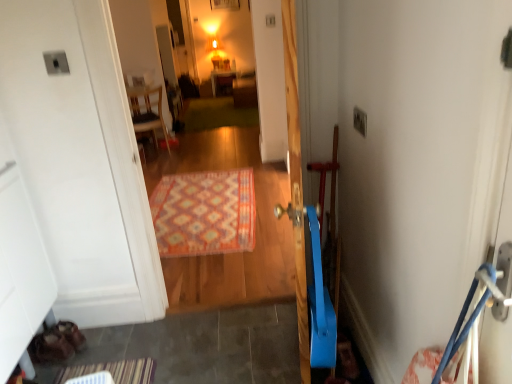
In order to face multicolored woven rug at center, should I rotate leftwards or rightwards?

Rotate left and turn 7.452 degrees.

Describe the element at coordinates (222, 82) in the screenshot. I see `matte wooden cabinet at center, acting as the second furniture starting from the bottom` at that location.

Find the location of a particular element. matte wooden cabinet at center, which is counted as the 1th furniture, starting from the back is located at coordinates (222, 82).

The height and width of the screenshot is (384, 512). Describe the element at coordinates (147, 111) in the screenshot. I see `wooden chair at upper left, the 2th furniture positioned from the top` at that location.

The image size is (512, 384). I want to click on carpeted rug at center, so click(x=256, y=226).

Locate an element on the screen. the 1st furniture behind the carpeted rug at center, starting your count from the anchor is located at coordinates (147, 111).

Is wooden chair at upper left, the second furniture from the right, not within carpeted rug at center?

Indeed, wooden chair at upper left, the second furniture from the right, is completely outside carpeted rug at center.

From the image's perspective, between wooden chair at upper left, which appears as the 1th furniture when ordered from the bottom, and carpeted rug at center, who is located below?

carpeted rug at center.

Which object is further away from the camera taking this photo, wooden chair at upper left, arranged as the 1th furniture when viewed from the front, or carpeted rug at center?

Positioned behind is wooden chair at upper left, arranged as the 1th furniture when viewed from the front.

Is carpeted rug at center oriented away from wooden chair at upper left, arranged as the 1th furniture when viewed from the front?

Absolutely, carpeted rug at center is directed away from wooden chair at upper left, arranged as the 1th furniture when viewed from the front.

Considering the relative positions of carpeted rug at center and wooden chair at upper left, arranged as the 1th furniture when viewed from the front, in the image provided, is carpeted rug at center behind wooden chair at upper left, arranged as the 1th furniture when viewed from the front,?

No, carpeted rug at center is in front of wooden chair at upper left, arranged as the 1th furniture when viewed from the front.

How far apart are carpeted rug at center and wooden chair at upper left, the 2th furniture positioned from the top?

carpeted rug at center is 36.75 inches away from wooden chair at upper left, the 2th furniture positioned from the top.

In the scene shown: From the image's perspective, relative to wooden chair at upper left, arranged as the 1th furniture when viewed from the front, is carpeted rug at center above or below?

carpeted rug at center is below wooden chair at upper left, arranged as the 1th furniture when viewed from the front.

Could you tell me if matte wooden cabinet at center, which is counted as the 1th furniture, starting from the back, is facing multicolored woven rug at center?

Yes, matte wooden cabinet at center, which is counted as the 1th furniture, starting from the back, is turned towards multicolored woven rug at center.

Is matte wooden cabinet at center, which is the 2th furniture from left to right, further to camera compared to multicolored woven rug at center?

Yes, matte wooden cabinet at center, which is the 2th furniture from left to right, is behind multicolored woven rug at center.

From the image's perspective, is matte wooden cabinet at center, placed as the first furniture when sorted from right to left, located above multicolored woven rug at center?

Indeed, from the image's perspective, matte wooden cabinet at center, placed as the first furniture when sorted from right to left, is shown above multicolored woven rug at center.

From a real-world perspective, starting from the multicolored woven rug at center, which furniture is the 2nd one vertically above it? Please provide its 2D coordinates.

[(147, 111)]

From a real-world perspective, is wooden chair at upper left, which ranks as the 2th furniture in back-to-front order, above or below multicolored woven rug at center?

In terms of real-world spatial position, wooden chair at upper left, which ranks as the 2th furniture in back-to-front order, is above multicolored woven rug at center.

How different are the orientations of wooden chair at upper left, which ranks as the 1th furniture in left-to-right order, and multicolored woven rug at center in degrees?

The facing directions of wooden chair at upper left, which ranks as the 1th furniture in left-to-right order, and multicolored woven rug at center are 148 degrees apart.

In terms of width, does wooden chair at upper left, arranged as the 1th furniture when viewed from the front, look wider or thinner when compared to multicolored woven rug at center?

Considering their sizes, wooden chair at upper left, arranged as the 1th furniture when viewed from the front, looks slimmer than multicolored woven rug at center.

From a real-world perspective, which is physically below, carpeted rug at center or multicolored woven rug at center?

multicolored woven rug at center, from a real-world perspective.

Is carpeted rug at center in contact with multicolored woven rug at center?

They are not placed beside each other.

How many degrees apart are the facing directions of carpeted rug at center and multicolored woven rug at center?

The angle between the facing direction of carpeted rug at center and the facing direction of multicolored woven rug at center is 1.27 degrees.

Considering the sizes of objects carpeted rug at center and multicolored woven rug at center in the image provided, who is taller, carpeted rug at center or multicolored woven rug at center?

Standing taller between the two is carpeted rug at center.

Looking at this image, considering the relative sizes of matte wooden cabinet at center, which is counted as the 1th furniture, starting from the back, and carpeted rug at center in the image provided, is matte wooden cabinet at center, which is counted as the 1th furniture, starting from the back, taller than carpeted rug at center?

In fact, matte wooden cabinet at center, which is counted as the 1th furniture, starting from the back, may be shorter than carpeted rug at center.

Considering the sizes of objects matte wooden cabinet at center, which is counted as the 1th furniture, starting from the back, and carpeted rug at center in the image provided, who is thinner, matte wooden cabinet at center, which is counted as the 1th furniture, starting from the back, or carpeted rug at center?

Thinner between the two is carpeted rug at center.

Would you consider matte wooden cabinet at center, which is counted as the 1th furniture, starting from the back, to be distant from carpeted rug at center?

That's right, there is a large distance between matte wooden cabinet at center, which is counted as the 1th furniture, starting from the back, and carpeted rug at center.

In terms of width, does matte wooden cabinet at center, placed as the first furniture when sorted from right to left, look wider or thinner when compared to wooden chair at upper left, which appears as the 1th furniture when ordered from the bottom?

In the image, matte wooden cabinet at center, placed as the first furniture when sorted from right to left, appears to be wider than wooden chair at upper left, which appears as the 1th furniture when ordered from the bottom.

Can you confirm if matte wooden cabinet at center, which is the 2th furniture from front to back, is shorter than wooden chair at upper left, the second furniture from the right?

Yes.

From the image's perspective, is matte wooden cabinet at center, placed as the first furniture when sorted from right to left, beneath wooden chair at upper left, the 2th furniture positioned from the top?

No, from the image's perspective, matte wooden cabinet at center, placed as the first furniture when sorted from right to left, is not beneath wooden chair at upper left, the 2th furniture positioned from the top.

Considering the positions of objects matte wooden cabinet at center, which is the 2th furniture from front to back, and wooden chair at upper left, which ranks as the 2th furniture in back-to-front order, in the image provided, who is more to the right, matte wooden cabinet at center, which is the 2th furniture from front to back, or wooden chair at upper left, which ranks as the 2th furniture in back-to-front order,?

From the viewer's perspective, matte wooden cabinet at center, which is the 2th furniture from front to back, appears more on the right side.

Where is `furniture that is the 1st one when counting upward from the carpeted rug at center (from the image's perspective)`? furniture that is the 1st one when counting upward from the carpeted rug at center (from the image's perspective) is located at coordinates (147, 111).

Which furniture is the 2nd one when counting from the left side of the carpeted rug at center? Please provide its 2D coordinates.

[(147, 111)]

Which object lies nearer to the anchor point multicolored woven rug at center, matte wooden cabinet at center, which is the 2th furniture from front to back, or wooden chair at upper left, arranged as the 1th furniture when viewed from the front?

The object closer to multicolored woven rug at center is wooden chair at upper left, arranged as the 1th furniture when viewed from the front.

Estimate the real-world distances between objects in this image. Which object is further from wooden chair at upper left, arranged as the 1th furniture when viewed from the front, matte wooden cabinet at center, which is the 2th furniture from left to right, or carpeted rug at center?

matte wooden cabinet at center, which is the 2th furniture from left to right.

When comparing their distances from matte wooden cabinet at center, which is counted as the first furniture, starting from the top, does multicolored woven rug at center or wooden chair at upper left, the second furniture from the right, seem closer?

Based on the image, wooden chair at upper left, the second furniture from the right, appears to be nearer to matte wooden cabinet at center, which is counted as the first furniture, starting from the top.

Based on their spatial positions, is carpeted rug at center or matte wooden cabinet at center, acting as the second furniture starting from the bottom, closer to wooden chair at upper left, which appears as the 1th furniture when ordered from the bottom?

The object closer to wooden chair at upper left, which appears as the 1th furniture when ordered from the bottom, is carpeted rug at center.

Looking at the image, which one is located closer to matte wooden cabinet at center, which is counted as the 1th furniture, starting from the back, carpeted rug at center or multicolored woven rug at center?

Among the two, carpeted rug at center is located nearer to matte wooden cabinet at center, which is counted as the 1th furniture, starting from the back.

Looking at the image, which one is located further to carpeted rug at center, wooden chair at upper left, arranged as the 1th furniture when viewed from the front, or matte wooden cabinet at center, which is counted as the first furniture, starting from the top?

matte wooden cabinet at center, which is counted as the first furniture, starting from the top, is further to carpeted rug at center.

Based on their spatial positions, is carpeted rug at center or wooden chair at upper left, which ranks as the 2th furniture in back-to-front order, closer to multicolored woven rug at center?

carpeted rug at center lies closer to multicolored woven rug at center than the other object.

Based on their spatial positions, is wooden chair at upper left, which appears as the 1th furniture when ordered from the bottom, or carpeted rug at center further from multicolored woven rug at center?

wooden chair at upper left, which appears as the 1th furniture when ordered from the bottom, is further to multicolored woven rug at center.

This screenshot has width=512, height=384. Identify the location of doormat positioned between carpeted rug at center and matte wooden cabinet at center, which is counted as the 1th furniture, starting from the back, from near to far. (204, 213).

I want to click on furniture located between carpeted rug at center and matte wooden cabinet at center, which is counted as the 1th furniture, starting from the back, in the depth direction, so click(x=147, y=111).

The image size is (512, 384). In order to click on furniture positioned between multicolored woven rug at center and matte wooden cabinet at center, which is counted as the first furniture, starting from the top, from near to far in this screenshot , I will do `click(147, 111)`.

Image resolution: width=512 pixels, height=384 pixels. In order to click on doormat positioned between carpeted rug at center and wooden chair at upper left, which appears as the 1th furniture when ordered from the bottom, from near to far in this screenshot , I will do `click(204, 213)`.